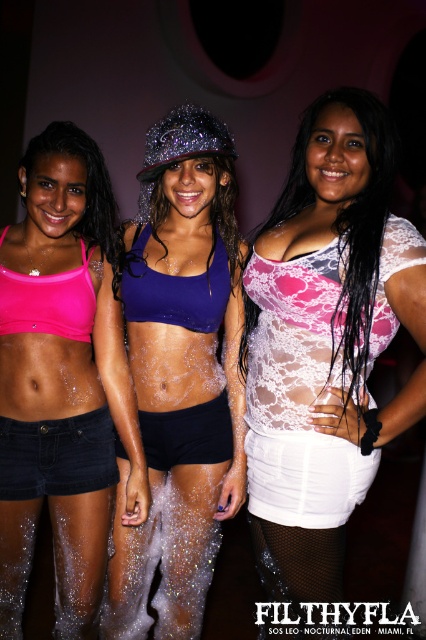
Question: Among these objects, which one is farthest from the camera?

Choices:
 (A) lace fabric top at center
 (B) pink matte sports bra at center

Answer: (B)

Question: Which point is closer to the camera?

Choices:
 (A) (100, 556)
 (B) (97, 460)
 (C) (164, 429)

Answer: (A)

Question: From the image, what is the correct spatial relationship of pink matte sports bra at center in relation to denim shorts at lower left?

Choices:
 (A) below
 (B) above

Answer: (B)

Question: Is white lace underwear at lower center below satin shiny shorts at center?

Choices:
 (A) yes
 (B) no

Answer: (A)

Question: From the image, what is the correct spatial relationship of white lace underwear at lower center in relation to satin shiny shorts at center?

Choices:
 (A) above
 (B) below

Answer: (B)

Question: Which is nearer to the satin shiny shorts at center?

Choices:
 (A) denim shorts at lower left
 (B) white lace underwear at lower center
 (C) purple shiny sports bra at center
 (D) lace fabric top at center

Answer: (C)